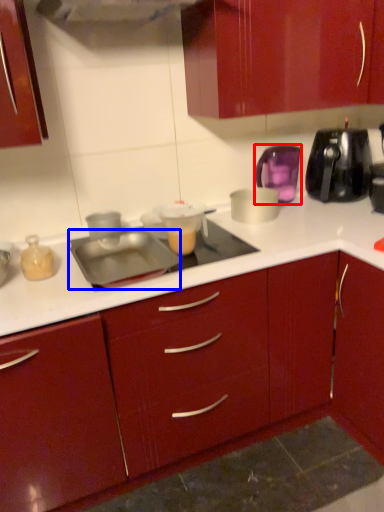
Question: Which of the following is the closest to the observer, kitchen appliance (highlighted by a red box) or appliance (highlighted by a blue box)?

Choices:
 (A) kitchen appliance
 (B) appliance

Answer: (B)